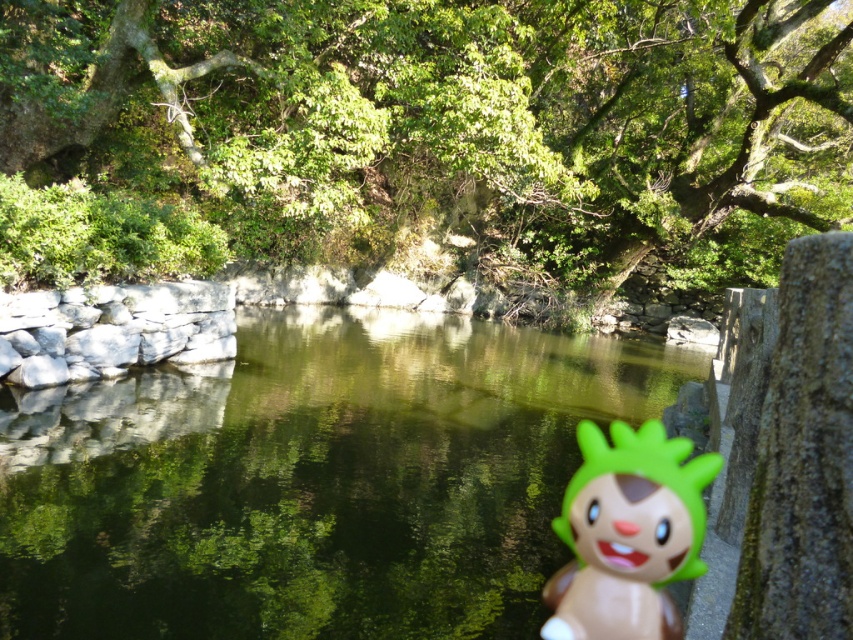
Question: Estimate the real-world distances between objects in this image. Which object is farther from the green plastic toy at right?

Choices:
 (A) green leafy tree at upper center
 (B) green reflective water at center

Answer: (A)

Question: Does green leafy tree at upper center appear over green plastic toy at right?

Choices:
 (A) no
 (B) yes

Answer: (B)

Question: Based on their relative distances, which object is farther from the green leafy tree at upper center?

Choices:
 (A) green plastic toy at right
 (B) green reflective water at center

Answer: (A)

Question: Based on their relative distances, which object is nearer to the green reflective water at center?

Choices:
 (A) green leafy tree at upper center
 (B) green plastic toy at right

Answer: (B)

Question: Is green reflective water at center thinner than green plastic toy at right?

Choices:
 (A) no
 (B) yes

Answer: (A)

Question: Does green reflective water at center have a greater width compared to green plastic toy at right?

Choices:
 (A) no
 (B) yes

Answer: (B)